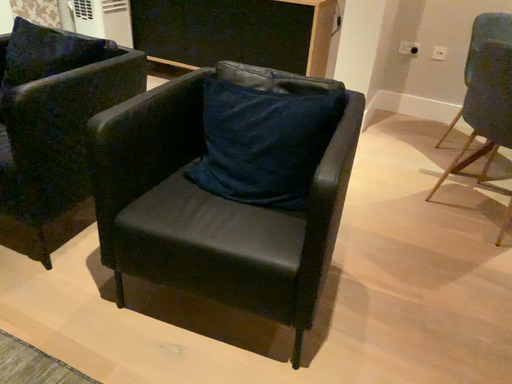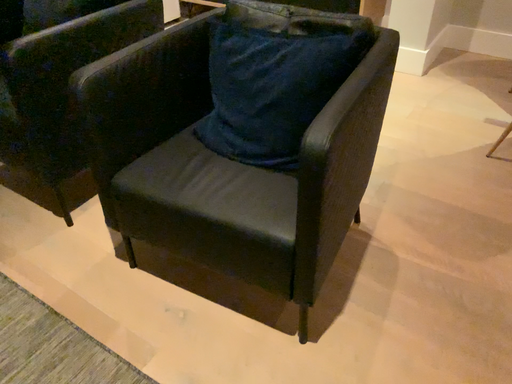
Question: How did the camera likely rotate when shooting the video?

Choices:
 (A) rotated left
 (B) rotated right

Answer: (A)